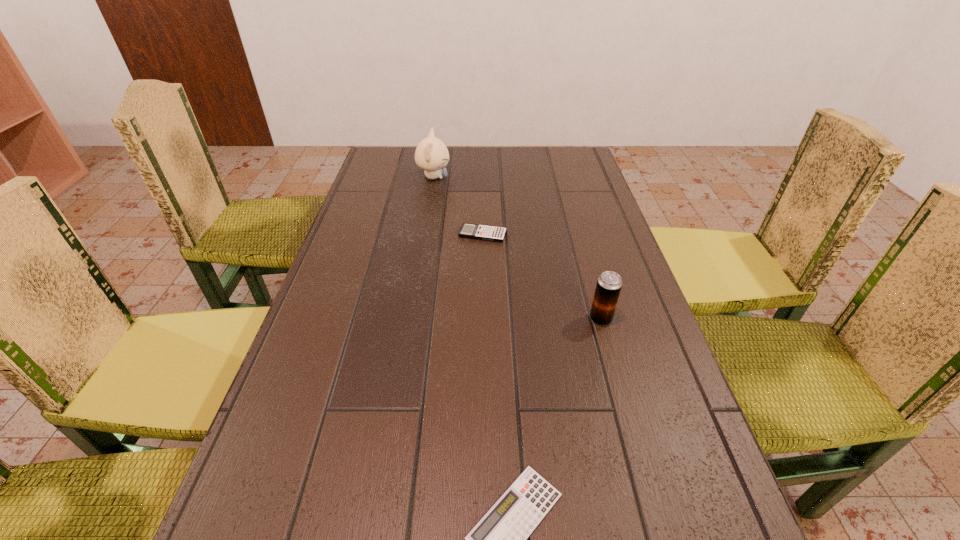
Locate an element on the screen. object that is at the right edge is located at coordinates (609, 284).

Locate an element on the screen. The image size is (960, 540). vacant space at the far edge of the desktop is located at coordinates (539, 151).

At what (x,y) coordinates should I click in order to perform the action: click on free space at the left edge of the desktop. Please return your answer as a coordinate pair (x, y). Image resolution: width=960 pixels, height=540 pixels. Looking at the image, I should click on (270, 408).

You are a GUI agent. You are given a task and a screenshot of the screen. Output one action in this format:
    pyautogui.click(x=<x>, y=<y>)
    Task: Click on the vacant space at the right edge of the desktop
    
    Given the screenshot: What is the action you would take?
    pyautogui.click(x=646, y=406)

The height and width of the screenshot is (540, 960). In order to click on vacant region at the far left corner of the desktop in this screenshot , I will do tap(396, 164).

At what (x,y) coordinates should I click in order to perform the action: click on vacant point at the far right corner. Please return your answer as a coordinate pair (x, y). Looking at the image, I should click on (577, 161).

The width and height of the screenshot is (960, 540). Find the location of `empty space that is in between the farther calculator and the beer can`. empty space that is in between the farther calculator and the beer can is located at coordinates (541, 276).

You are a GUI agent. You are given a task and a screenshot of the screen. Output one action in this format:
    pyautogui.click(x=<x>, y=<y>)
    Task: Click on the free spot between the tallest object and the second tallest object
    Image resolution: width=960 pixels, height=540 pixels.
    Given the screenshot: What is the action you would take?
    pyautogui.click(x=517, y=248)

Identify the location of vacant space that is in between the second shortest object and the third shortest object. (541, 276).

Locate an element on the screen. free space between the kitten and the farther calculator is located at coordinates (458, 206).